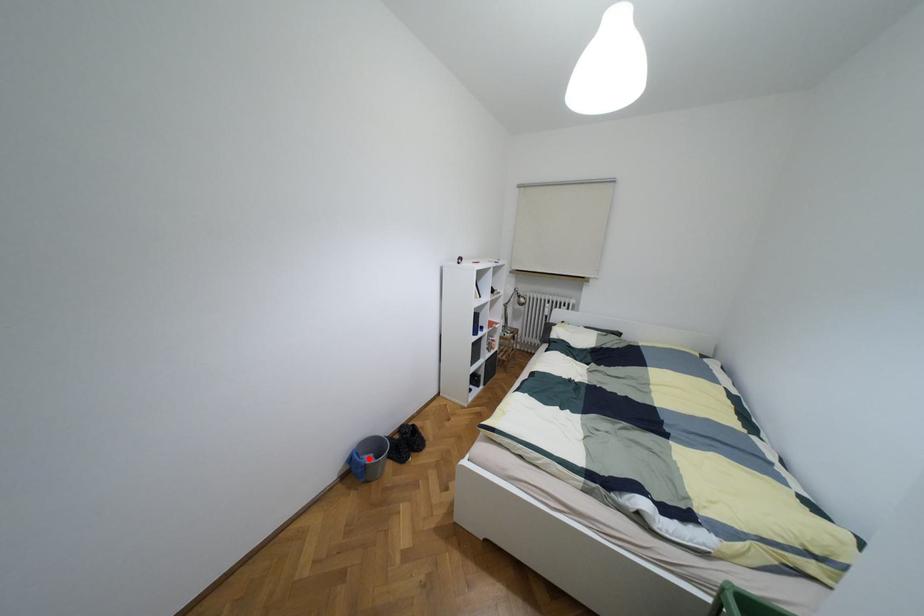
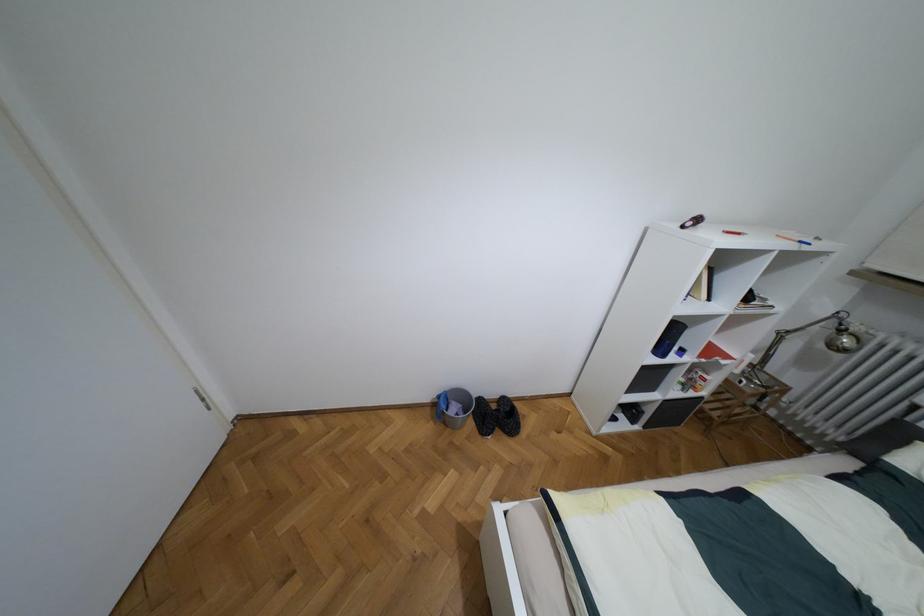
Question: I am providing you with two images of the same scene from different viewpoints. Given a red point in image1, look at the same physical point in image2. Is it:

Choices:
 (A) Closer to the viewpoint
 (B) Farther from the viewpoint

Answer: (B)